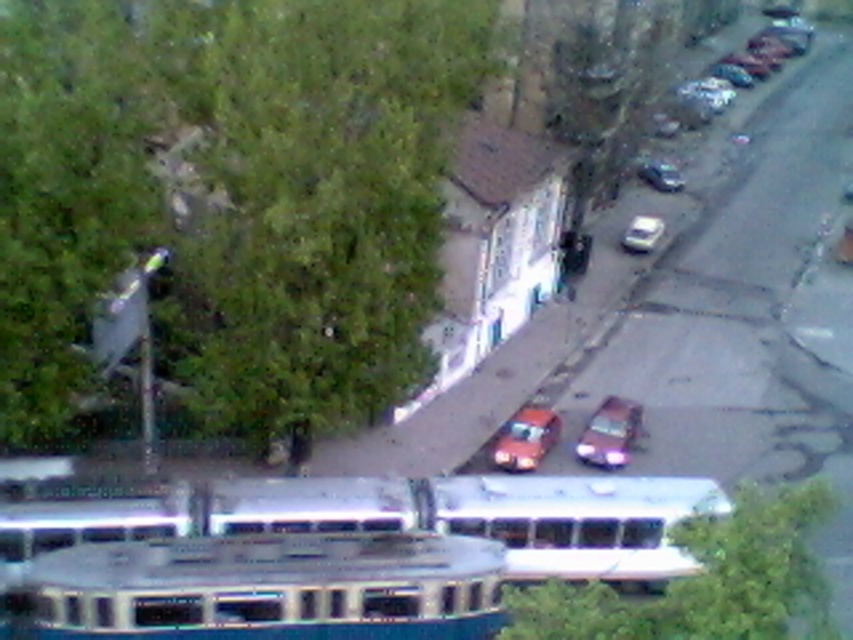
Question: Is metallic silver bus at center further to the viewer compared to shiny silver car at lower right?

Choices:
 (A) no
 (B) yes

Answer: (A)

Question: Which point is closer to the camera?

Choices:
 (A) green leafy tree at upper left
 (B) metallic silver bus at lower left

Answer: (B)

Question: Does white glossy bus at center appear on the right side of shiny orange car at center?

Choices:
 (A) yes
 (B) no

Answer: (A)

Question: Does white glossy bus at center appear over shiny silver car at lower right?

Choices:
 (A) yes
 (B) no

Answer: (B)

Question: Which point appears farthest from the camera in this image?

Choices:
 (A) (129, 140)
 (B) (767, 516)
 (C) (421, 486)

Answer: (A)

Question: Among these points, which one is nearest to the camera?

Choices:
 (A) (645, 227)
 (B) (387, 595)
 (C) (323, 506)

Answer: (B)